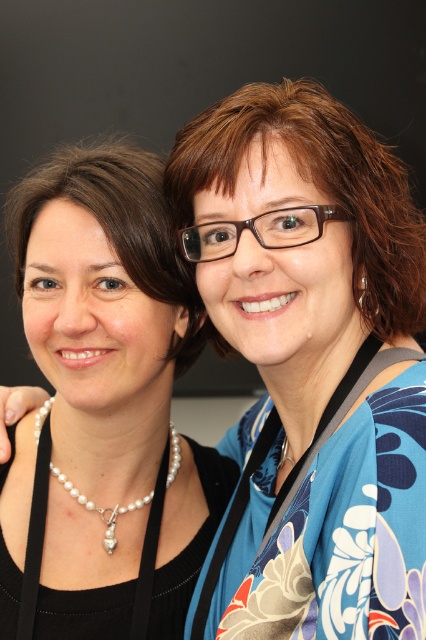
What do you see at coordinates (310, 362) in the screenshot? Image resolution: width=426 pixels, height=640 pixels. I see `blue floral kimono at center` at bounding box center [310, 362].

Is blue floral kimono at center thinner than pearl necklace at left?

No.

Where is `blue floral kimono at center`? This screenshot has height=640, width=426. blue floral kimono at center is located at coordinates (310, 362).

Find the location of a particular element. The height and width of the screenshot is (640, 426). blue floral kimono at center is located at coordinates (310, 362).